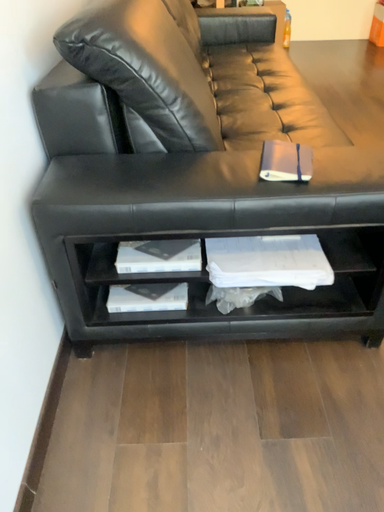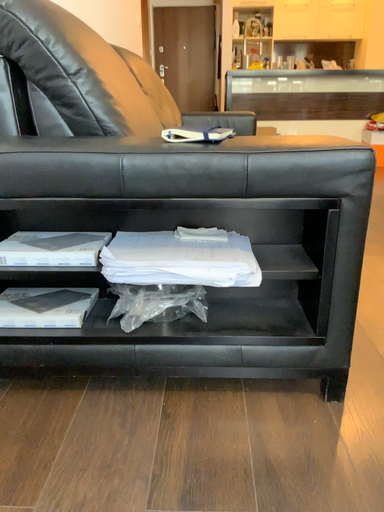
Question: Which way did the camera rotate in the video?

Choices:
 (A) rotated downward
 (B) rotated upward

Answer: (B)